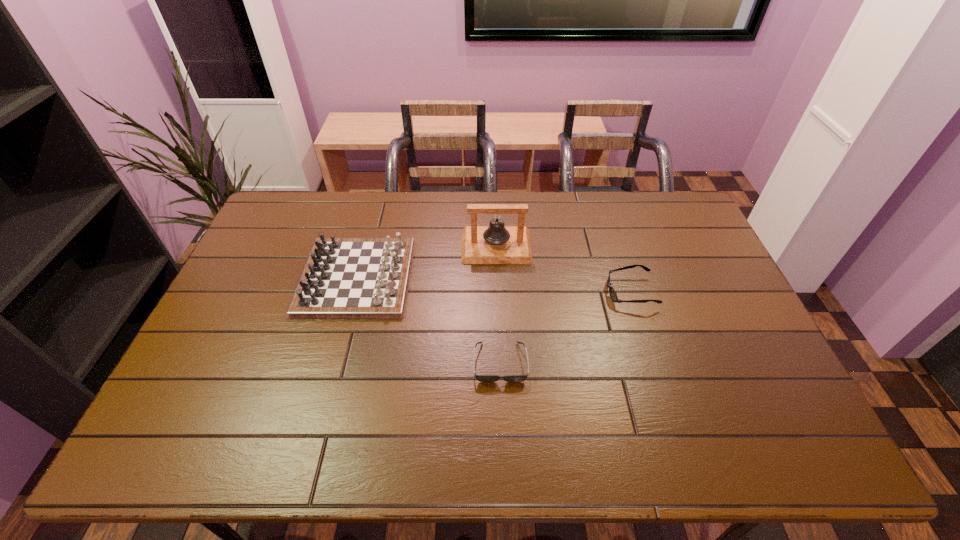
The height and width of the screenshot is (540, 960). In order to click on vacant space situated on the lenses of the right sunglasses in this screenshot , I will do `click(590, 292)`.

In order to click on free space located on the lenses of the right sunglasses in this screenshot , I will do `click(528, 292)`.

Locate an element on the screen. The height and width of the screenshot is (540, 960). free space located 0.090m on the front-facing side of the shortest object is located at coordinates (502, 416).

Find the location of `object that is at the far edge`. object that is at the far edge is located at coordinates (495, 244).

Where is `vacant space at the far edge`? The height and width of the screenshot is (540, 960). vacant space at the far edge is located at coordinates (428, 194).

The height and width of the screenshot is (540, 960). In order to click on vacant area at the near edge of the desktop in this screenshot , I will do `click(512, 446)`.

In the image, there is a desktop. At what (x,y) coordinates should I click in order to perform the action: click on vacant space at the left edge. Please return your answer as a coordinate pair (x, y). This screenshot has width=960, height=540. Looking at the image, I should click on (180, 415).

Where is `free space at the far left corner of the desktop`? free space at the far left corner of the desktop is located at coordinates (291, 217).

What are the coordinates of `vacant area that lies between the right sunglasses and the chessboard` in the screenshot? It's located at (493, 285).

Where is `free spot between the second shortest object and the shorter sunglasses`? The width and height of the screenshot is (960, 540). free spot between the second shortest object and the shorter sunglasses is located at coordinates (565, 327).